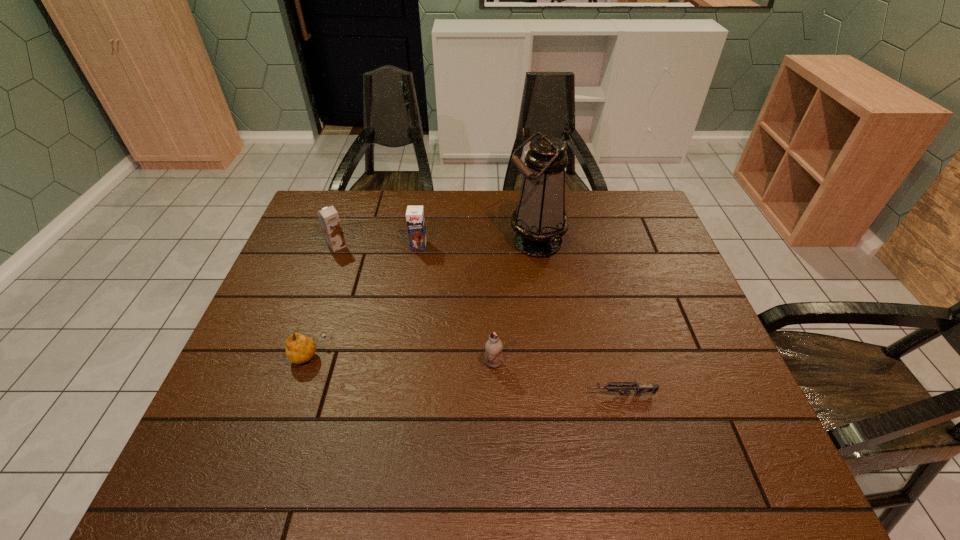
Image resolution: width=960 pixels, height=540 pixels. In order to click on free location located 0.090m on the front label of the second chocolate milk from right to left in this screenshot , I will do `click(415, 271)`.

Where is `free space located 0.080m on the right of the fourth tallest object`? free space located 0.080m on the right of the fourth tallest object is located at coordinates (536, 363).

This screenshot has width=960, height=540. In order to click on vacant area located on the right of the pear in this screenshot , I will do point(430,356).

Locate an element on the screen. This screenshot has width=960, height=540. vacant space located 0.240m aimed along the barrel of the shortest object is located at coordinates (x=476, y=395).

This screenshot has width=960, height=540. In order to click on free region located 0.380m aimed along the barrel of the shortest object in this screenshot , I will do `click(413, 395)`.

I want to click on free space located 0.310m aimed along the barrel of the shortest object, so click(444, 395).

At what (x,y) coordinates should I click in order to perform the action: click on object present at the far edge. Please return your answer as a coordinate pair (x, y). The image size is (960, 540). Looking at the image, I should click on (540, 221).

Find the location of a particular element. chocolate milk present at the left edge is located at coordinates click(328, 216).

At what (x,y) coordinates should I click in order to perform the action: click on pear that is at the left edge. Please return your answer as a coordinate pair (x, y). This screenshot has width=960, height=540. Looking at the image, I should click on (300, 348).

At what (x,y) coordinates should I click in order to perform the action: click on free region at the far edge of the desktop. Please return your answer as a coordinate pair (x, y). The width and height of the screenshot is (960, 540). Looking at the image, I should click on (498, 214).